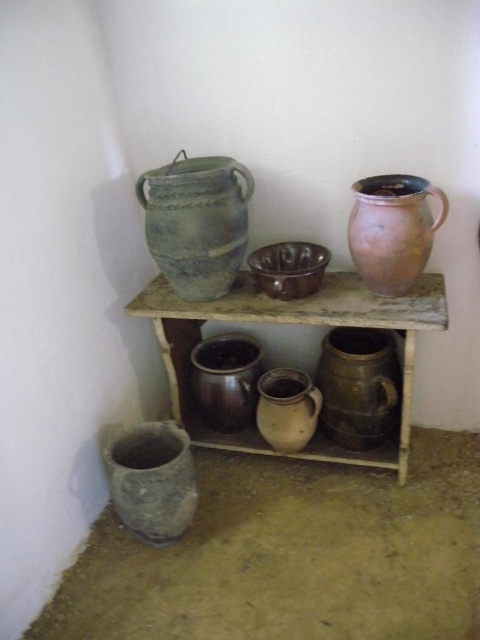
Is point (367, 401) positioned in front of point (278, 376)?

Yes, it is in front of point (278, 376).

This screenshot has width=480, height=640. What do you see at coordinates (359, 387) in the screenshot? I see `matte brown jug at center` at bounding box center [359, 387].

Who is more distant from viewer, (356,339) or (305,426)?

The point (356,339) is behind.

Locate an element on the screen. matte brown jug at center is located at coordinates (359, 387).

Is rusty ceramic pitcher at upper right to the left of earthy clay pot at lower left from the viewer's perspective?

No, rusty ceramic pitcher at upper right is not to the left of earthy clay pot at lower left.

Can you confirm if rusty ceramic pitcher at upper right is thinner than earthy clay pot at lower left?

Yes, rusty ceramic pitcher at upper right is thinner than earthy clay pot at lower left.

Is point (372, 278) in front of point (153, 541)?

Yes.

The width and height of the screenshot is (480, 640). I want to click on rusty ceramic pitcher at upper right, so tap(393, 228).

Which of these two, green earthenware pot at upper left or rusty ceramic pitcher at upper right, stands taller?

Standing taller between the two is green earthenware pot at upper left.

Which is more to the left, green earthenware pot at upper left or rusty ceramic pitcher at upper right?

green earthenware pot at upper left is more to the left.

Is point (172, 259) in front of point (415, 182)?

That is False.

The width and height of the screenshot is (480, 640). Find the location of `green earthenware pot at upper left`. green earthenware pot at upper left is located at coordinates (196, 221).